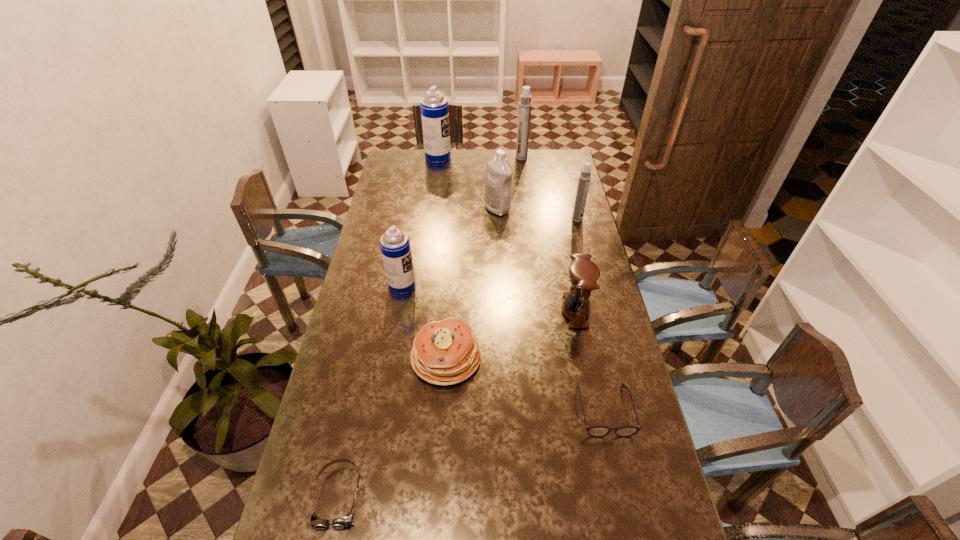
Choose which object is the seventh nearest neighbor to the smaller white aerosol can. Please provide its 2D coordinates. Your answer should be formatted as a tuple, i.e. [(x, y)], where the tuple contains the x and y coordinates of a point satisfying the conditions above.

[(595, 431)]

You are a GUI agent. You are given a task and a screenshot of the screen. Output one action in this format:
    pyautogui.click(x=<x>, y=<y>)
    Task: Click on the aerosol can that stands as the second closest to the bigger blue aerosol can
    This screenshot has width=960, height=540.
    Given the screenshot: What is the action you would take?
    pyautogui.click(x=584, y=178)

Locate an element on the screen. The image size is (960, 540). aerosol can that is the second closest to the second nearest aerosol can is located at coordinates (434, 108).

Where is `free point that satisfies the following two spatial constraints: 1. on the front side of the fifth object from left to right; 2. on the left side of the nearer white aerosol can`? free point that satisfies the following two spatial constraints: 1. on the front side of the fifth object from left to right; 2. on the left side of the nearer white aerosol can is located at coordinates (497, 219).

Where is `vacant region that satisfies the following two spatial constraints: 1. on the front side of the nearer white aerosol can; 2. on the right side of the white detergent`? Image resolution: width=960 pixels, height=540 pixels. vacant region that satisfies the following two spatial constraints: 1. on the front side of the nearer white aerosol can; 2. on the right side of the white detergent is located at coordinates (497, 219).

Locate an element on the screen. The image size is (960, 540). blank space that satisfies the following two spatial constraints: 1. on the back side of the fourth shortest object; 2. on the right side of the pancake is located at coordinates (449, 310).

Find the location of a particular element. This screenshot has width=960, height=540. free space that satisfies the following two spatial constraints: 1. on the label side of the smaller blue aerosol can; 2. on the back side of the pancake is located at coordinates (390, 357).

The width and height of the screenshot is (960, 540). Find the location of `blank space that satisfies the following two spatial constraints: 1. on the label side of the nearest aerosol can; 2. on the left side of the pancake`. blank space that satisfies the following two spatial constraints: 1. on the label side of the nearest aerosol can; 2. on the left side of the pancake is located at coordinates (390, 357).